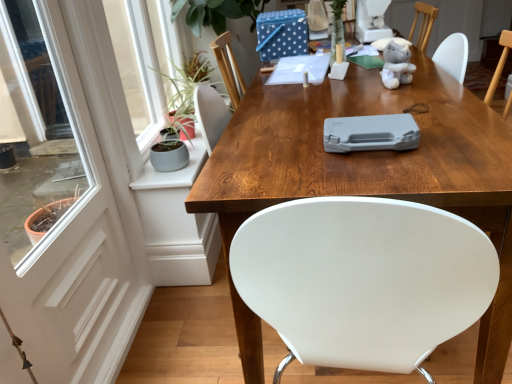
Question: Considering their positions, is wooden table at center located in front of or behind soft gray plush bear at upper right?

Choices:
 (A) front
 (B) behind

Answer: (A)

Question: In the image, is wooden table at center on the left side or the right side of soft gray plush bear at upper right?

Choices:
 (A) left
 (B) right

Answer: (A)

Question: Which is nearer to the wooden table at center?

Choices:
 (A) white glossy screen door at left
 (B) soft gray plush bear at upper right

Answer: (B)

Question: Which is farther from the soft gray plush bear at upper right?

Choices:
 (A) wooden table at center
 (B) white glossy screen door at left

Answer: (B)